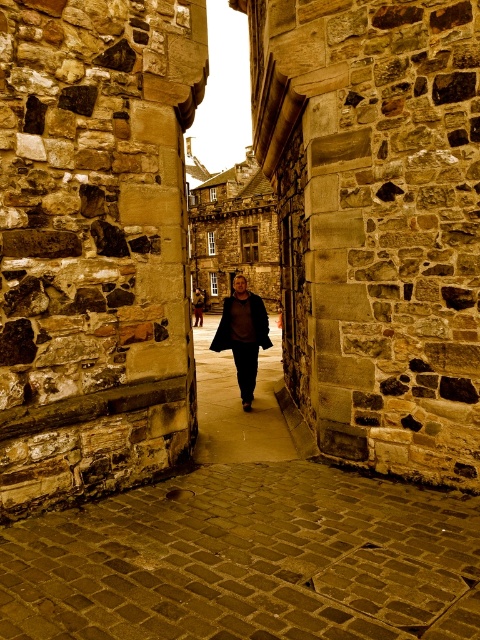
Question: Can you confirm if dark brown leather jacket at center is smaller than matte brown coat at center?

Choices:
 (A) no
 (B) yes

Answer: (B)

Question: Is dark brown leather jacket at center positioned behind matte brown coat at center?

Choices:
 (A) no
 (B) yes

Answer: (A)

Question: Is dark brown leather jacket at center closer to camera compared to matte brown coat at center?

Choices:
 (A) no
 (B) yes

Answer: (B)

Question: Which object is farther from the camera taking this photo?

Choices:
 (A) matte brown coat at center
 (B) dark brown leather jacket at center

Answer: (A)